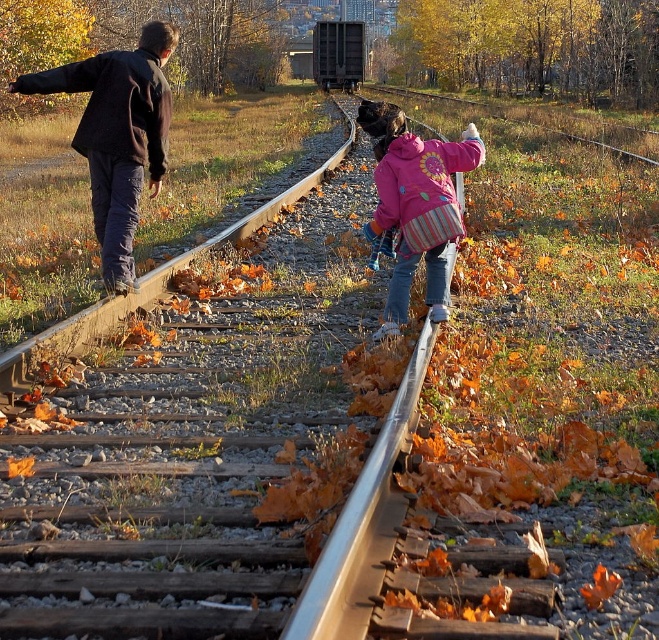
Question: Does dark brown jacket at left appear over pink fleece jacket at center?

Choices:
 (A) no
 (B) yes

Answer: (B)

Question: Among these points, which one is farthest from the camera?

Choices:
 (A) (438, 305)
 (B) (136, 58)

Answer: (B)

Question: Does dark brown jacket at left have a greater width compared to pink fleece jacket at center?

Choices:
 (A) no
 (B) yes

Answer: (B)

Question: Is dark brown jacket at left below pink fleece jacket at center?

Choices:
 (A) yes
 (B) no

Answer: (B)

Question: Which point is farther from the camera taking this photo?

Choices:
 (A) pos(132,124)
 (B) pos(438,248)

Answer: (A)